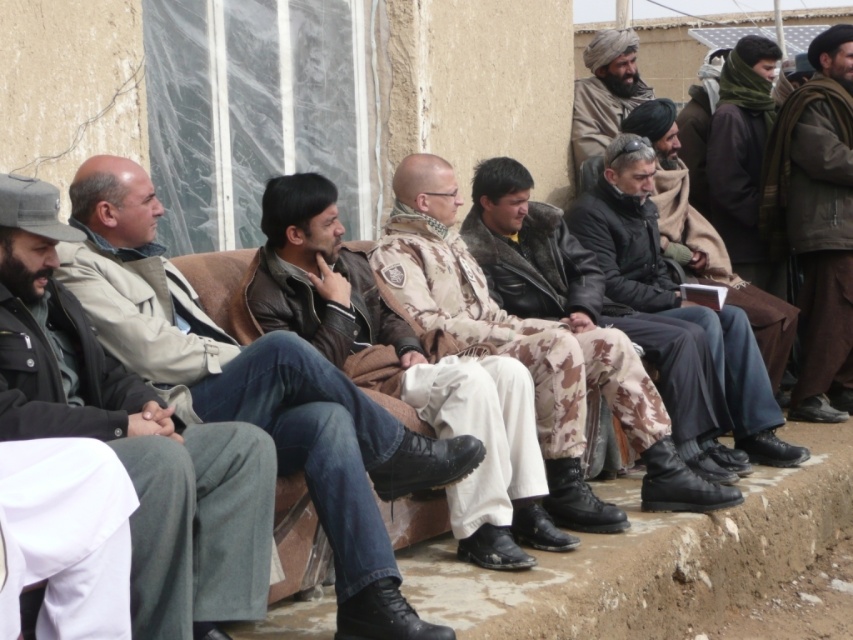
Question: Which object is the closest to the camouflage pants at center?

Choices:
 (A) brown woolen scarf at upper right
 (B) camouflage uniform at center
 (C) camouflage jacket at center

Answer: (B)

Question: Among these points, which one is farthest from the camera?

Choices:
 (A) (560, 257)
 (B) (635, 300)
 (C) (822, 182)

Answer: (C)

Question: Which object is farther from the camera taking this photo?

Choices:
 (A) camouflage pants at center
 (B) camouflage uniform at center
 (C) dark gray uniform at left

Answer: (A)

Question: Is camouflage pants at center smaller than brown woolen scarf at upper right?

Choices:
 (A) no
 (B) yes

Answer: (A)

Question: Is camouflage pants at center behind camouflage uniform at center?

Choices:
 (A) no
 (B) yes

Answer: (B)

Question: In this image, where is camouflage jacket at center located relative to brown leather jacket at center?

Choices:
 (A) below
 (B) above

Answer: (A)